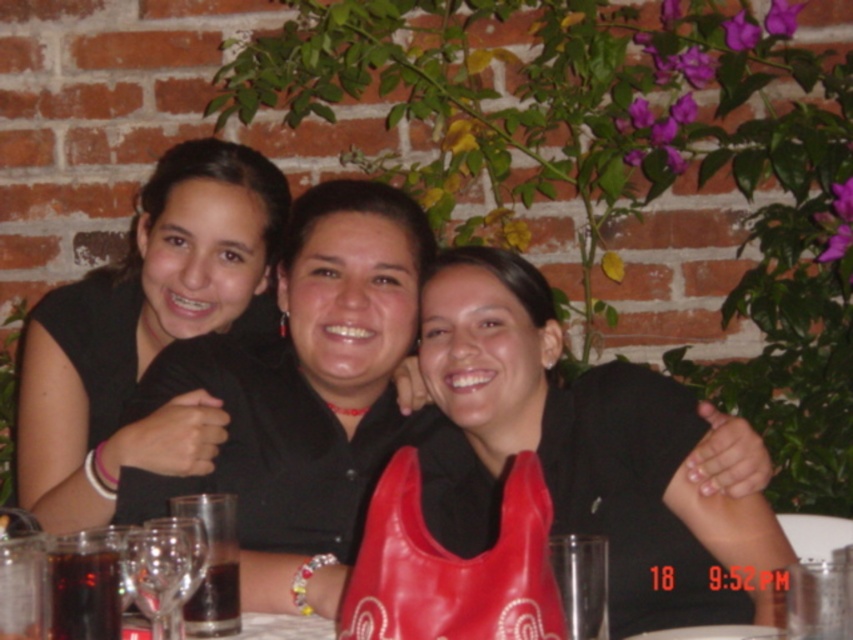
Question: Which of the following is the closest to the observer?

Choices:
 (A) transparent glass wine glass at center
 (B) black matte shirt at center
 (C) matte black shirt at center

Answer: (A)

Question: Estimate the real-world distances between objects in this image. Which object is closer to the matte black shirt at center?

Choices:
 (A) transparent glass wine glass at center
 (B) black matte shirt at center

Answer: (B)

Question: Is matte black shirt at center to the left of transparent glass wine glass at center from the viewer's perspective?

Choices:
 (A) no
 (B) yes

Answer: (A)

Question: Which object appears closest to the camera in this image?

Choices:
 (A) transparent glass wine glass at center
 (B) black matte shirt at center

Answer: (A)

Question: Is black matte shirt at center above transparent glass wine glass at center?

Choices:
 (A) yes
 (B) no

Answer: (A)

Question: Can you confirm if matte black shirt at center is positioned to the right of black matte shirt at center?

Choices:
 (A) no
 (B) yes

Answer: (B)